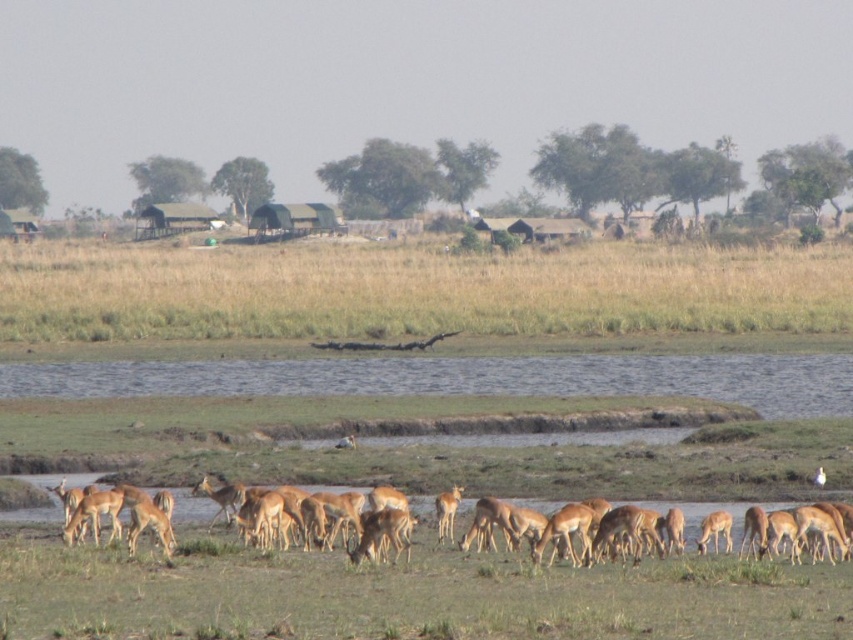
Question: Does clear water at center have a larger size compared to brown fur deer at lower right?

Choices:
 (A) yes
 (B) no

Answer: (A)

Question: Which object is farther from the camera taking this photo?

Choices:
 (A) clear water at center
 (B) brown fur antelope at center

Answer: (A)

Question: Can you confirm if dry grass at center is positioned to the right of brown fur antelope at center?

Choices:
 (A) no
 (B) yes

Answer: (B)

Question: Which of the following is the closest to the observer?

Choices:
 (A) (438, 515)
 (B) (544, 380)
 (C) (722, 520)
 (D) (265, 301)

Answer: (C)

Question: Can you confirm if clear water at center is positioned below brown fur deer at lower right?

Choices:
 (A) no
 (B) yes

Answer: (A)

Question: Among these objects, which one is nearest to the camera?

Choices:
 (A) light brown antelope at lower center
 (B) brown fur antelope at center
 (C) brown fur deer at lower right

Answer: (A)